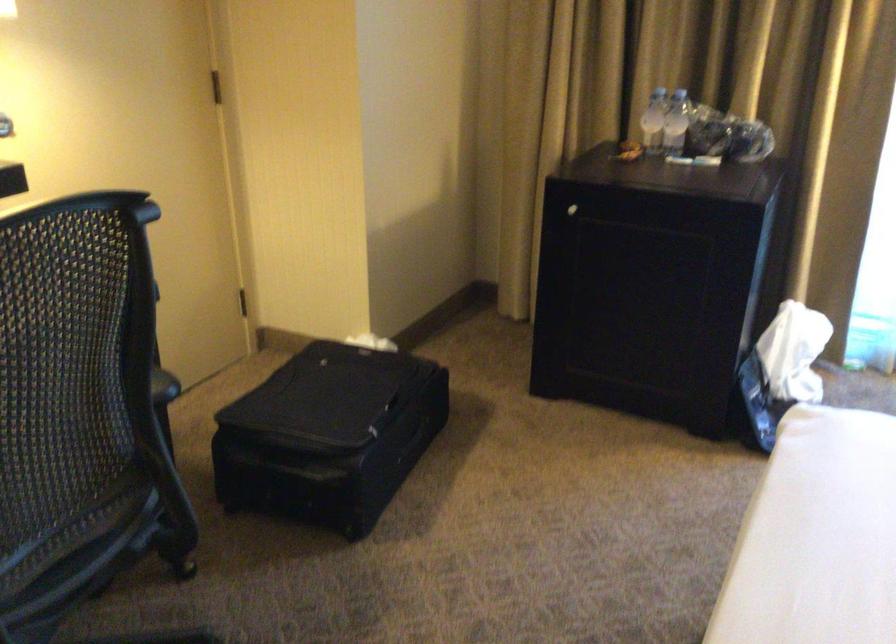
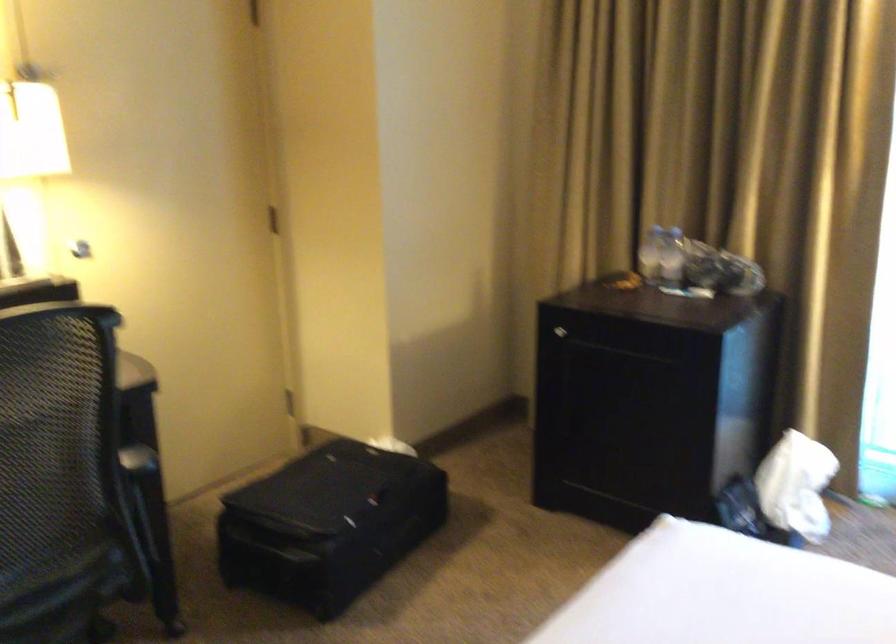
What movement of the cameraman would produce the second image?

The cameraman walked toward right, backward.